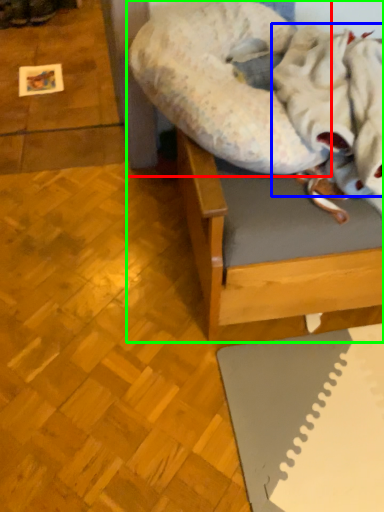
Question: Which is nearer to the dog bed (highlighted by a red box)? blanket (highlighted by a blue box) or furniture (highlighted by a green box).

Choices:
 (A) blanket
 (B) furniture

Answer: (B)